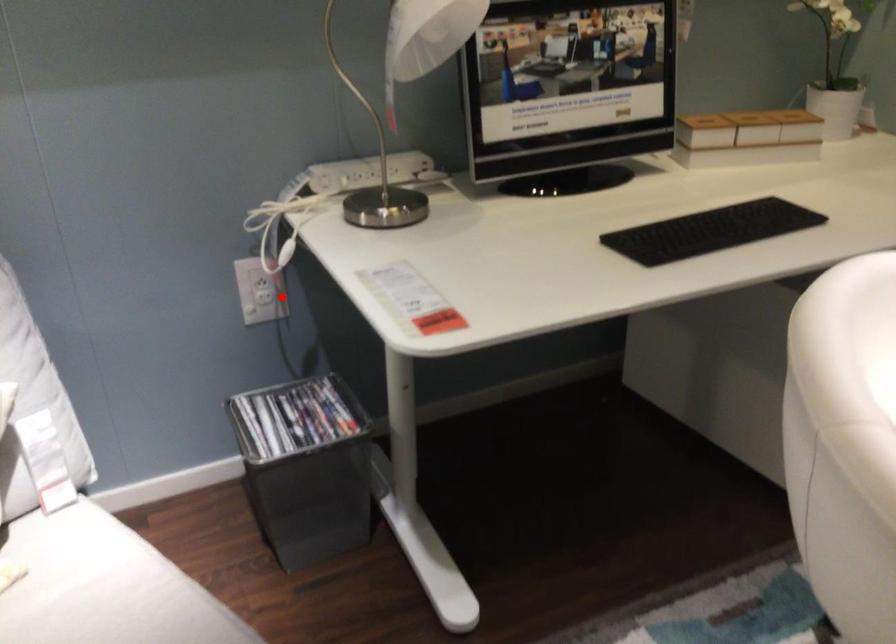
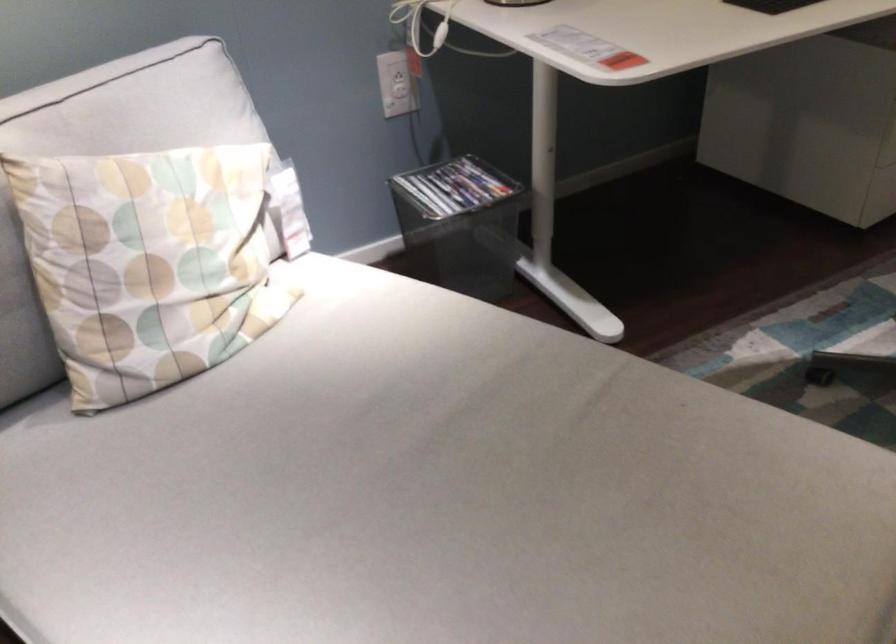
Find the pixel in the second image that matches the highlighted location in the first image.

(400, 91)